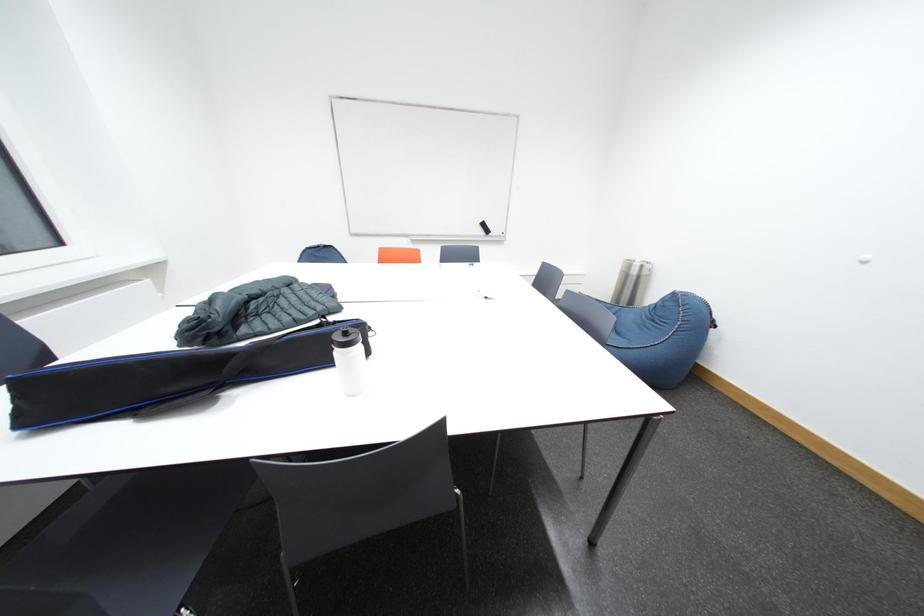
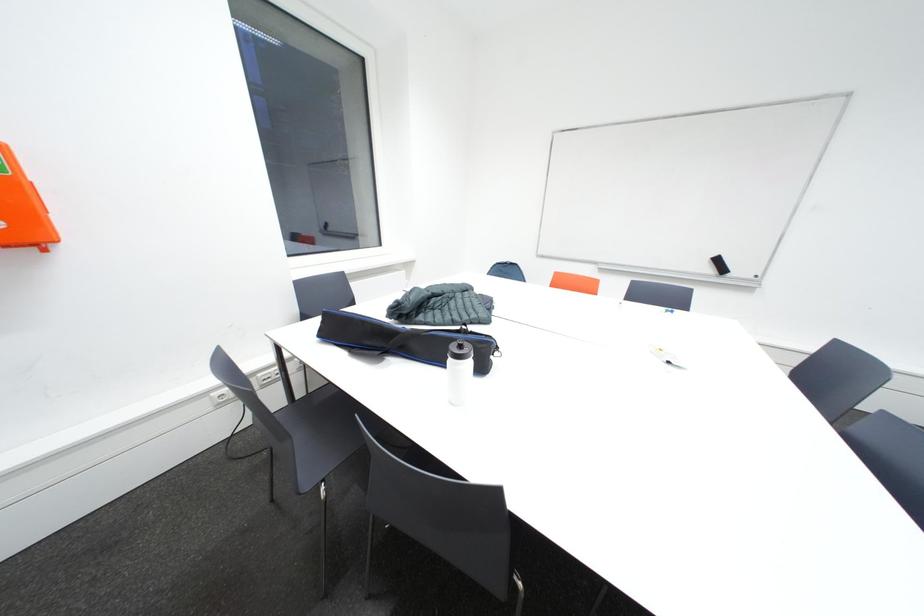
Question: The first image is from the beginning of the video and the second image is from the end. How did the camera likely rotate when shooting the video?

Choices:
 (A) Left
 (B) Right
 (C) Up
 (D) Down

Answer: (A)